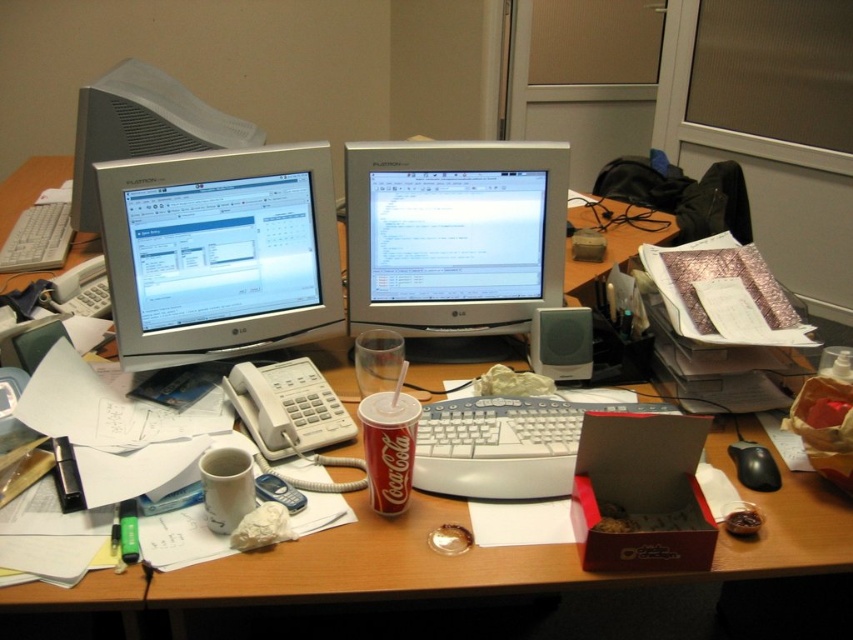
Does satin silver monitor at center appear over black plastic mouse at lower right?

Yes, satin silver monitor at center is above black plastic mouse at lower right.

Find the location of a particular element. The image size is (853, 640). satin silver monitor at center is located at coordinates (453, 236).

The height and width of the screenshot is (640, 853). Find the location of `satin silver monitor at center`. satin silver monitor at center is located at coordinates (453, 236).

Is matte silver monitor at center left wider than coca-cola can at center?

Correct, the width of matte silver monitor at center left exceeds that of coca-cola can at center.

Is matte silver monitor at center left thinner than coca-cola can at center?

No.

Which is behind, point (164, 246) or point (412, 424)?

Point (164, 246)

Identify the location of matte silver monitor at center left. (x=219, y=253).

Who is higher up, satin silver monitor at center or matte silver monitor at upper left?

Positioned higher is matte silver monitor at upper left.

Which is below, satin silver monitor at center or matte silver monitor at upper left?

satin silver monitor at center

Who is more forward, [430,237] or [223,124]?

Point [430,237] is in front.

Find the location of a particular element. The image size is (853, 640). satin silver monitor at center is located at coordinates click(x=453, y=236).